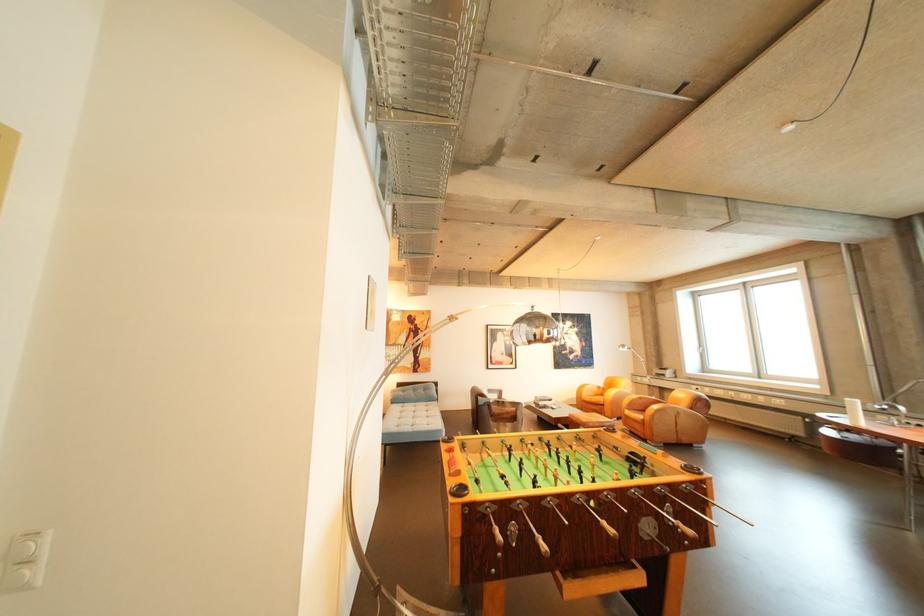
Identify the location of orange chair armrest. (589, 389).